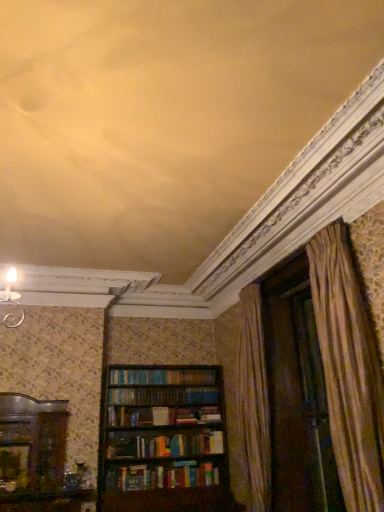
The width and height of the screenshot is (384, 512). I want to click on wooden bookcase at center, so click(x=165, y=440).

The width and height of the screenshot is (384, 512). What do you see at coordinates (165, 440) in the screenshot?
I see `wooden bookcase at center` at bounding box center [165, 440].

Where is `wooden bookcase at center`? wooden bookcase at center is located at coordinates (165, 440).